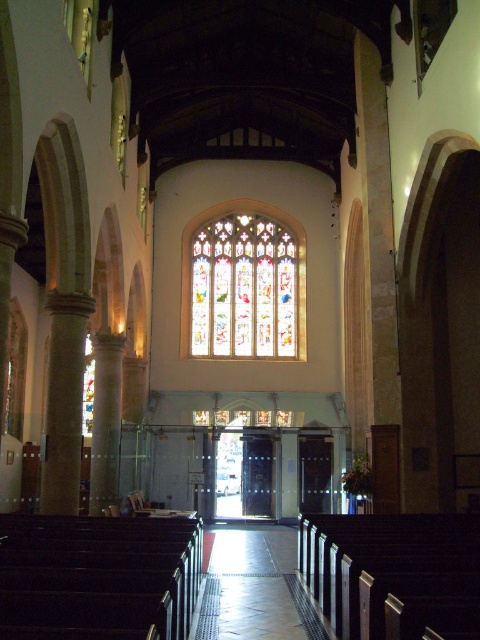
Which is more to the right, stained glass window at center or shiny metallic aisle at center?

shiny metallic aisle at center is more to the right.

Can you confirm if stained glass window at center is taller than shiny metallic aisle at center?

Correct, stained glass window at center is much taller as shiny metallic aisle at center.

This screenshot has width=480, height=640. What do you see at coordinates (243, 284) in the screenshot?
I see `stained glass window at center` at bounding box center [243, 284].

I want to click on stained glass window at center, so click(243, 284).